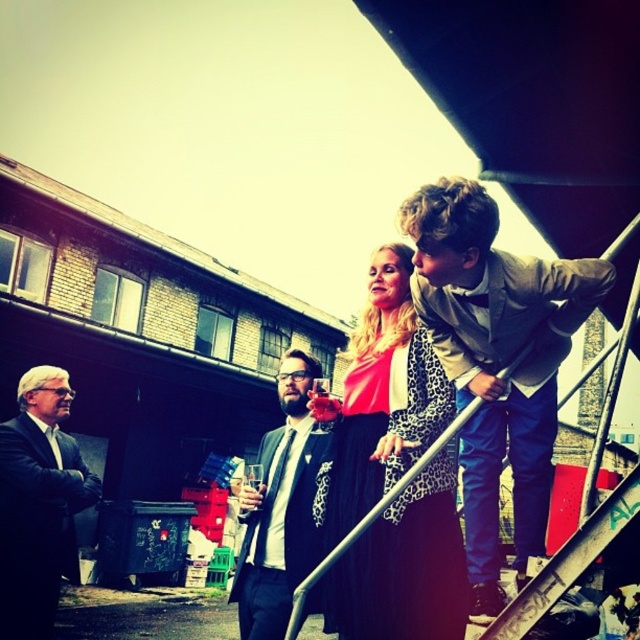
Question: Does light brown leather jacket at upper right have a lesser width compared to matte black suit at center?

Choices:
 (A) no
 (B) yes

Answer: (A)

Question: Which object is closer to the camera taking this photo?

Choices:
 (A) black suit at left
 (B) leopard print dress at center

Answer: (B)

Question: Which object is farther from the camera taking this photo?

Choices:
 (A) leopard print dress at center
 (B) black suit at left

Answer: (B)

Question: Can you confirm if black suit at left is positioned above matte black suit at center?

Choices:
 (A) yes
 (B) no

Answer: (B)

Question: Among these points, which one is nearest to the camera?

Choices:
 (A) (464, 445)
 (B) (58, 573)
 (C) (362, 554)

Answer: (C)

Question: Is black suit at left wider than matte black suit at center?

Choices:
 (A) yes
 (B) no

Answer: (B)